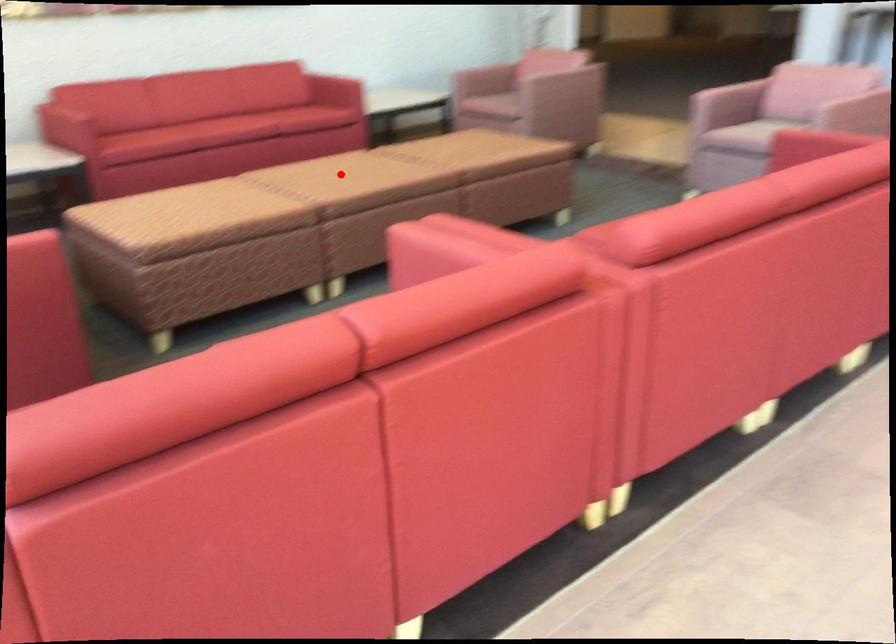
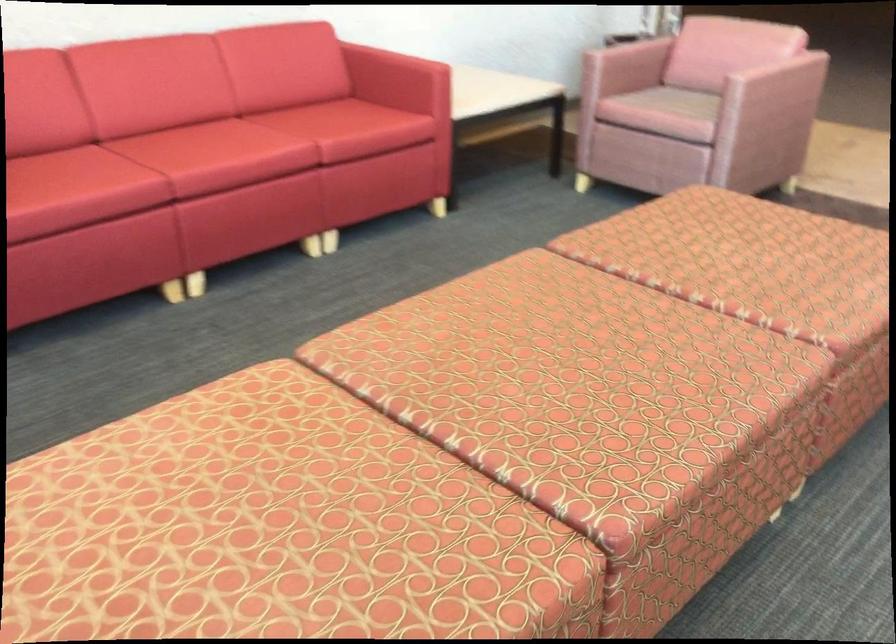
Where in the second image is the point corresponding to the highlighted location from the first image?

(549, 377)